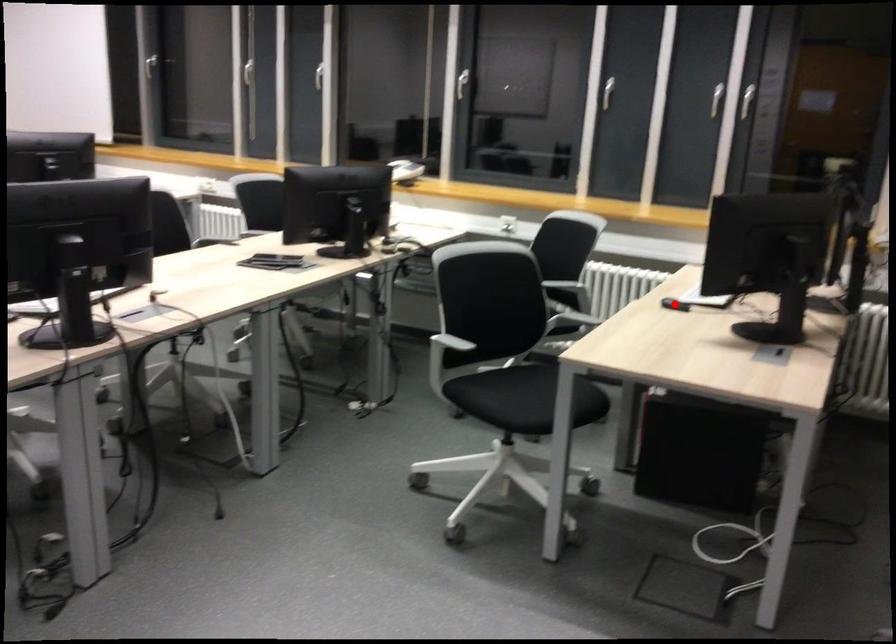
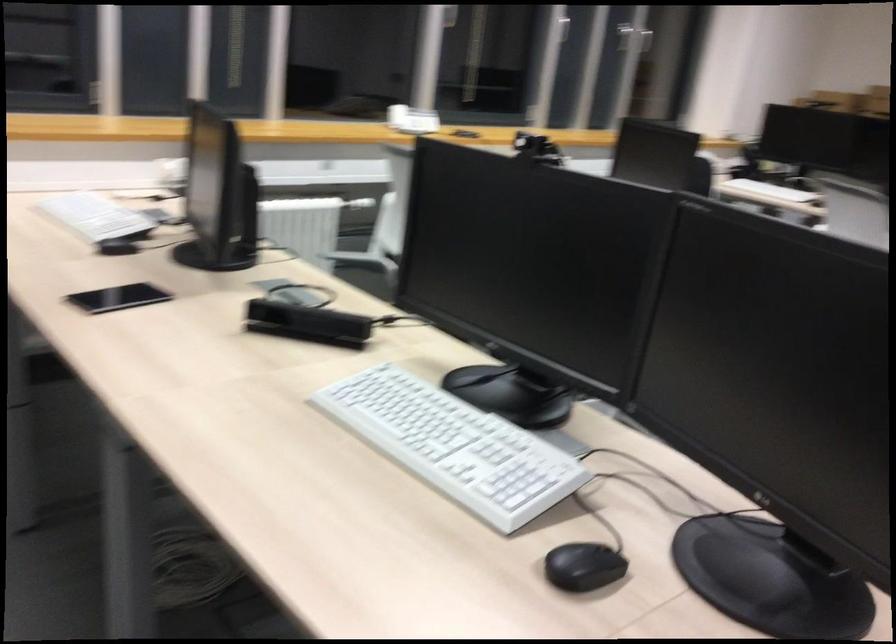
Question: I am providing you with two images of the same scene from different viewpoints. A red point is marked on the first image. Is the red point's position out of view in image 2?

Choices:
 (A) Yes
 (B) No

Answer: (A)